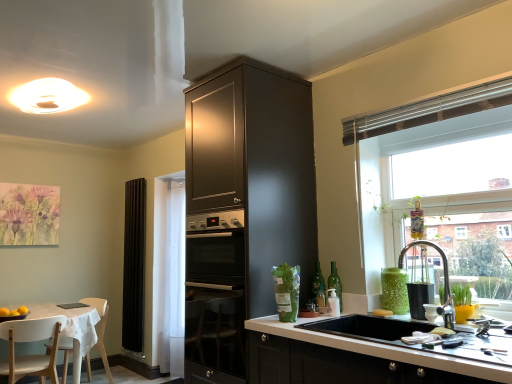
Question: Is the position of yellow matte soap at sink less distant than that of white glossy vase at lower right?

Choices:
 (A) yes
 (B) no

Answer: (B)

Question: Is yellow matte soap at sink outside of white glossy vase at lower right?

Choices:
 (A) no
 (B) yes

Answer: (B)

Question: Is yellow matte soap at sink shorter than white glossy vase at lower right?

Choices:
 (A) yes
 (B) no

Answer: (A)

Question: Does yellow matte soap at sink have a greater width compared to white glossy vase at lower right?

Choices:
 (A) no
 (B) yes

Answer: (B)

Question: Considering the relative sizes of yellow matte soap at sink and white glossy vase at lower right in the image provided, is yellow matte soap at sink taller than white glossy vase at lower right?

Choices:
 (A) yes
 (B) no

Answer: (B)

Question: From the image's perspective, relative to matte dark wood cabinet at center, is transparent glass window at upper right above or below?

Choices:
 (A) below
 (B) above

Answer: (B)

Question: In terms of width, does transparent glass window at upper right look wider or thinner when compared to matte dark wood cabinet at center?

Choices:
 (A) wide
 (B) thin

Answer: (B)

Question: Is transparent glass window at upper right taller or shorter than matte dark wood cabinet at center?

Choices:
 (A) tall
 (B) short

Answer: (B)

Question: Considering the positions of point (437, 109) and point (282, 231), is point (437, 109) closer or farther from the camera than point (282, 231)?

Choices:
 (A) farther
 (B) closer

Answer: (B)

Question: Considering the positions of white glossy vase at lower right and watercolor flowers at upper left in the image, is white glossy vase at lower right wider or thinner than watercolor flowers at upper left?

Choices:
 (A) wide
 (B) thin

Answer: (A)

Question: From the image's perspective, is white glossy vase at lower right positioned above or below watercolor flowers at upper left?

Choices:
 (A) above
 (B) below

Answer: (B)

Question: Is point (431, 314) positioned closer to the camera than point (8, 201)?

Choices:
 (A) closer
 (B) farther

Answer: (A)

Question: In terms of height, does white glossy vase at lower right look taller or shorter compared to watercolor flowers at upper left?

Choices:
 (A) short
 (B) tall

Answer: (A)

Question: Is matte dark wood cabinet at center wider or thinner than black fabric curtain at left?

Choices:
 (A) wide
 (B) thin

Answer: (A)

Question: From the image's perspective, is matte dark wood cabinet at center positioned above or below black fabric curtain at left?

Choices:
 (A) below
 (B) above

Answer: (B)